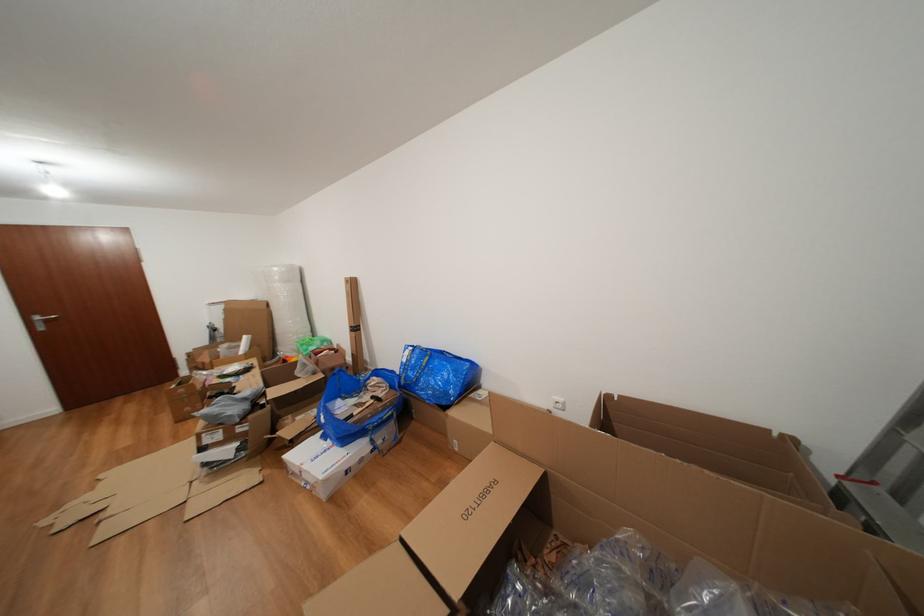
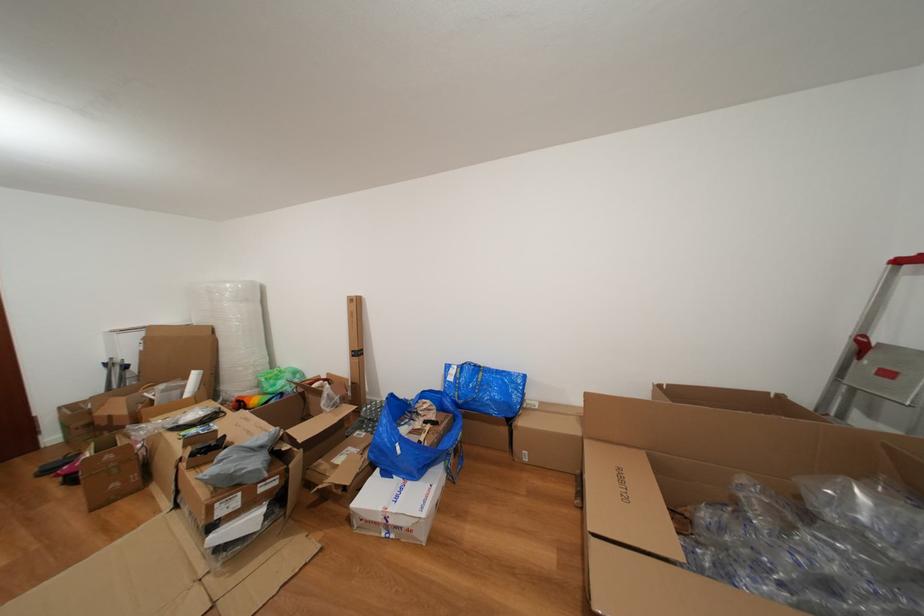
Find the pixel in the second image that matches pixel 412 365 in the first image.

(458, 384)